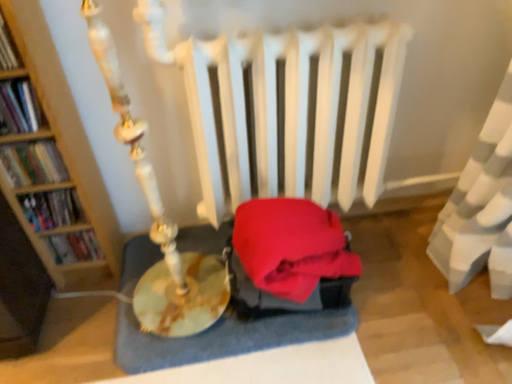
Question: Looking at their shapes, would you say wooden bookshelf at left, placed as the 3th book when sorted from top to bottom, is wider or thinner than hardcover book at left, the 2th book in the top-to-bottom sequence?

Choices:
 (A) thin
 (B) wide

Answer: (B)

Question: Relative to hardcover book at left, the 2th book in the top-to-bottom sequence, is wooden bookshelf at left, arranged as the 3th book when ordered from the bottom, in front or behind?

Choices:
 (A) behind
 (B) front

Answer: (A)

Question: Based on their relative distances, which object is farther from the velvet red cushion at center?

Choices:
 (A) hardcover book at left, the fourth book positioned from the top
 (B) hardcover book at left, which is counted as the 5th book, starting from the top
 (C) hardcover book at left, the 2th book in the top-to-bottom sequence
 (D) hardcover book at upper left, which is counted as the 1th book, starting from the top
 (E) wooden bookshelf at left, placed as the 3th book when sorted from top to bottom

Answer: (D)

Question: Which of these objects is positioned closest to the hardcover book at upper left, which is counted as the 1th book, starting from the top?

Choices:
 (A) hardcover book at left, positioned as the 2th book in bottom-to-top order
 (B) velvet red cushion at center
 (C) hardcover book at left, which is counted as the 5th book, starting from the top
 (D) wooden bookshelf at left, placed as the 3th book when sorted from top to bottom
 (E) hardcover book at left, the 4th book ordered from the bottom

Answer: (E)